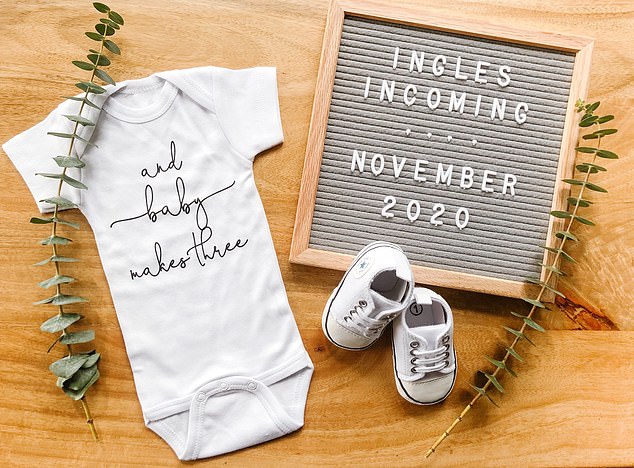
This screenshot has height=468, width=634. In order to click on wood frame in this screenshot , I will do `click(309, 159)`.